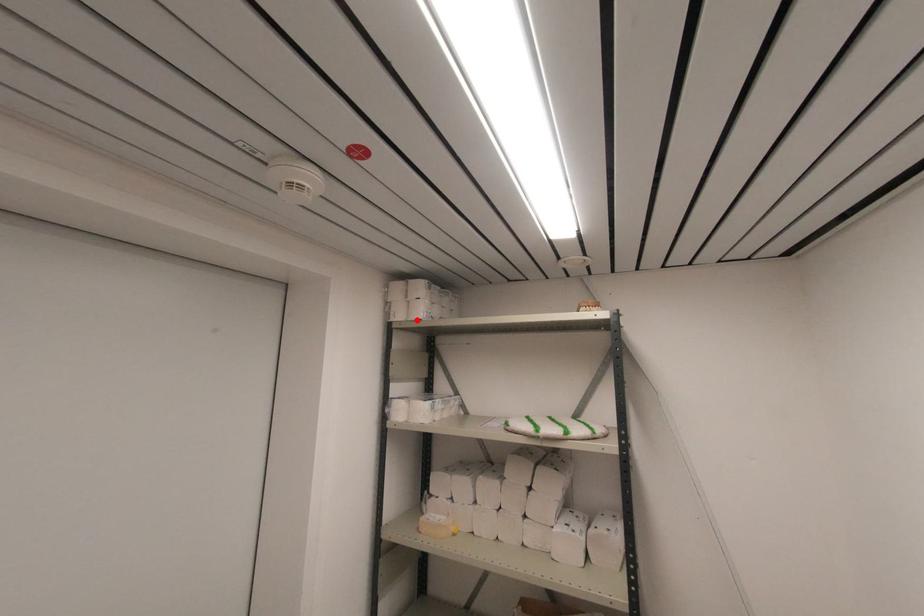
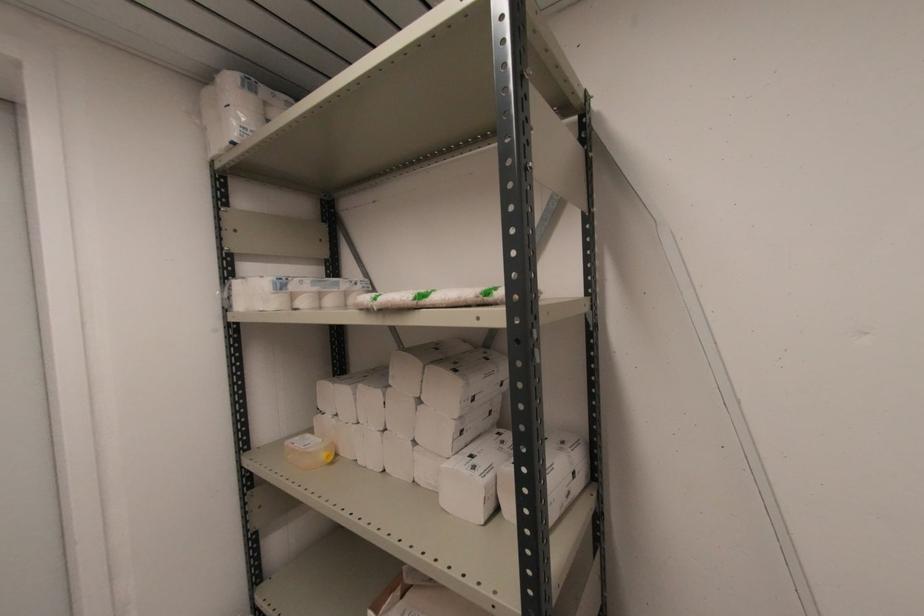
Find the pixel in the second image that matches the highlighted location in the first image.

(227, 144)